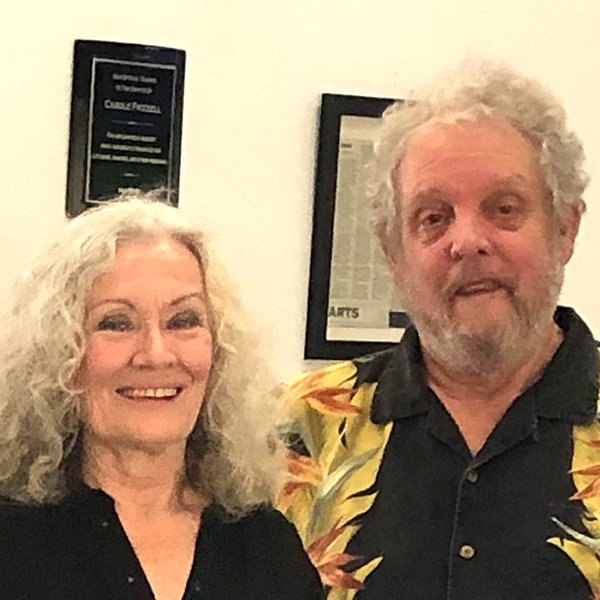
Where is `white wall`? The width and height of the screenshot is (600, 600). white wall is located at coordinates (219, 110).